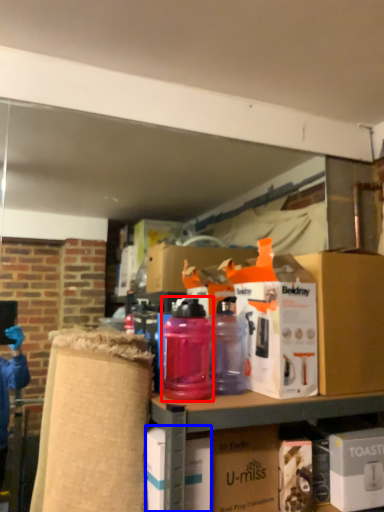
Question: Which object is closer to the camera taking this photo, bottle (highlighted by a red box) or box (highlighted by a blue box)?

Choices:
 (A) bottle
 (B) box

Answer: (B)